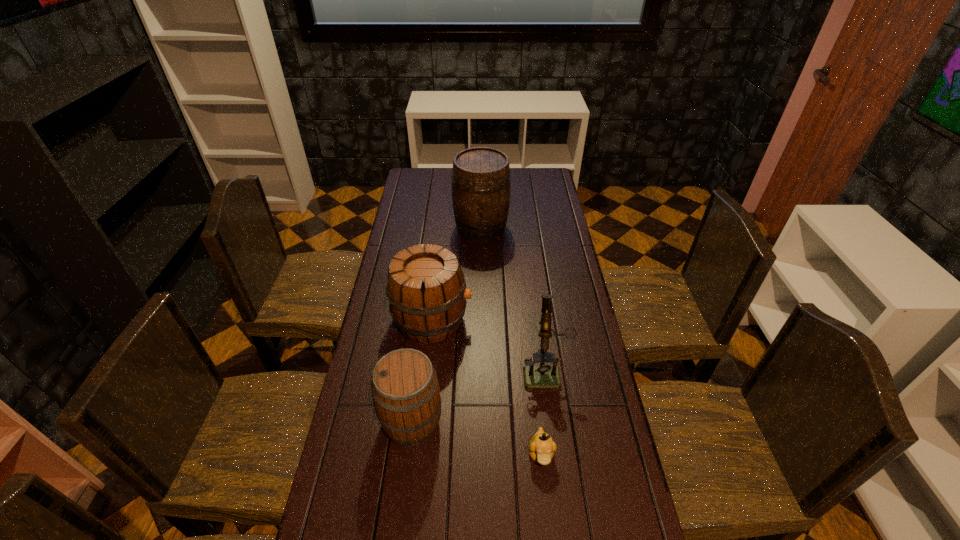
You are a GUI agent. You are given a task and a screenshot of the screen. Output one action in this format:
    pyautogui.click(x=<x>, y=<y>)
    Task: Click on the vacant space situated 0.140m on the face of the shortest object
    The height and width of the screenshot is (540, 960).
    Given the screenshot: What is the action you would take?
    click(549, 532)

Where is `object at the right edge`? The width and height of the screenshot is (960, 540). object at the right edge is located at coordinates (542, 376).

Locate an element on the screen. free region at the left edge is located at coordinates (348, 528).

At what (x,y) coordinates should I click in order to perform the action: click on free region at the right edge of the desktop. Please return your answer as a coordinate pair (x, y). The height and width of the screenshot is (540, 960). Looking at the image, I should click on (596, 375).

In the image, there is a desktop. Find the location of `vacant region at the far left corner`. vacant region at the far left corner is located at coordinates (426, 182).

Find the location of a particular element. The image size is (960, 540). vacant space at the far right corner of the desktop is located at coordinates (523, 178).

Locate an element on the screen. free space that is in between the shortest object and the second farthest cider is located at coordinates (487, 387).

You are a GUI agent. You are given a task and a screenshot of the screen. Output one action in this format:
    pyautogui.click(x=<x>, y=<y>)
    Task: Click on the unoccupied area between the microscope and the shortest object
    
    Given the screenshot: What is the action you would take?
    pyautogui.click(x=542, y=413)

You are a GUI agent. You are given a task and a screenshot of the screen. Output one action in this format:
    pyautogui.click(x=<x>, y=<y>)
    Task: Click on the vacant area that lies between the third farthest object and the farthest object
    This screenshot has width=960, height=540.
    Given the screenshot: What is the action you would take?
    pyautogui.click(x=513, y=299)

Identify the location of unoccupied area between the duckling and the farthest object. (511, 341).